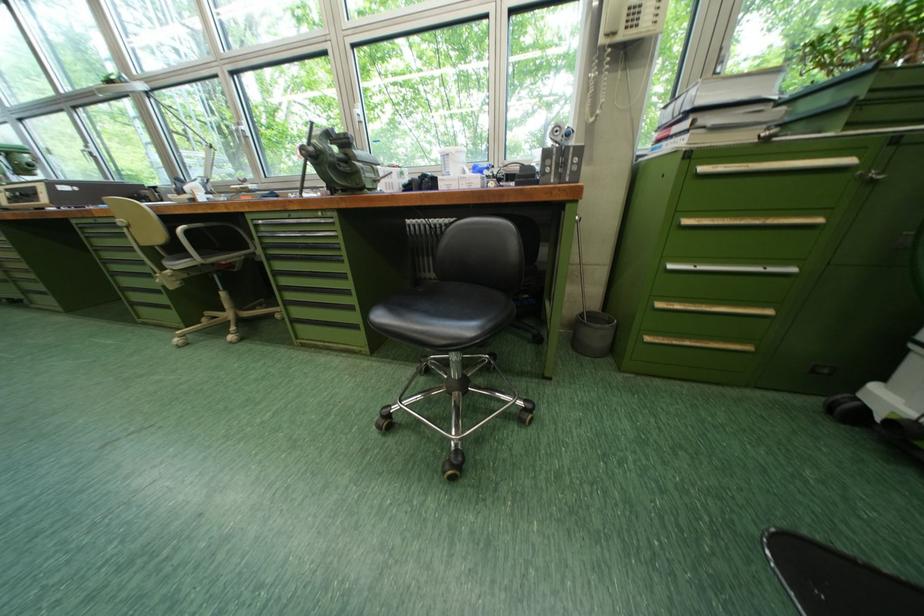
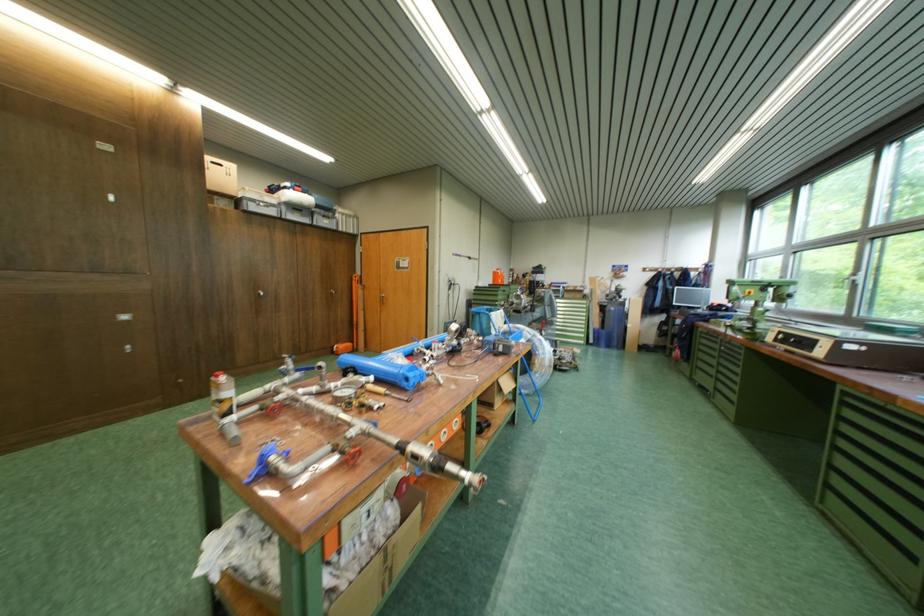
Question: Based on the continuous images, in which direction is the camera rotating? Reply with the corresponding letter.

Choices:
 (A) Left
 (B) Right
 (C) Up
 (D) Down

Answer: (A)